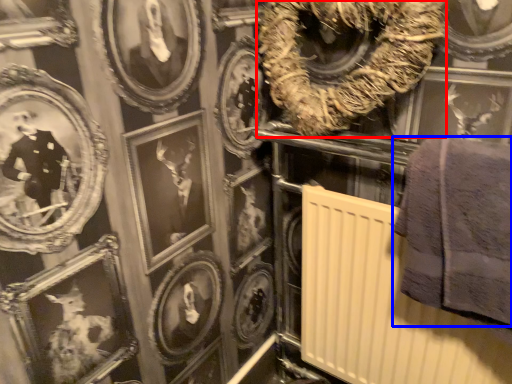
Question: Which object appears closest to the camera in this image, decor (highlighted by a red box) or towel (highlighted by a blue box)?

Choices:
 (A) decor
 (B) towel

Answer: (B)